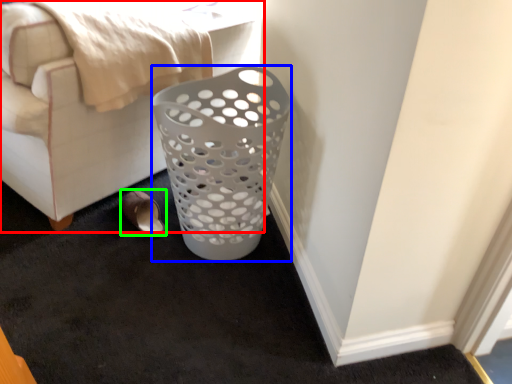
Question: Which is nearer to the furniture (highlighted by a red box)? basket (highlighted by a blue box) or footwear (highlighted by a green box).

Choices:
 (A) basket
 (B) footwear

Answer: (B)